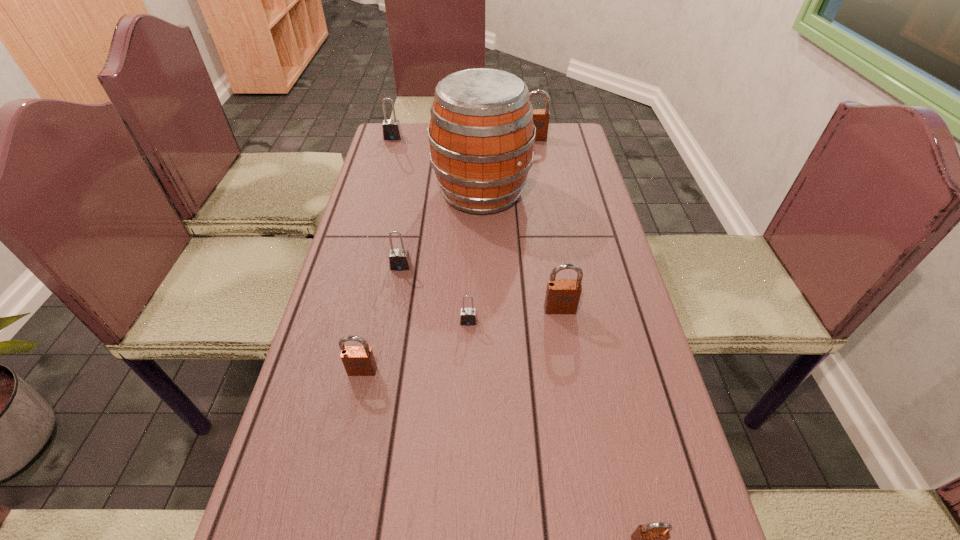
Where is `blank region between the second farthest brown padlock and the second biggest gray padlock`? This screenshot has height=540, width=960. blank region between the second farthest brown padlock and the second biggest gray padlock is located at coordinates (480, 288).

Locate an element on the screen. The height and width of the screenshot is (540, 960). vacant point located between the seventh shortest object and the sixth farthest padlock is located at coordinates (448, 255).

Find the location of a particular element. free space between the leftmost object and the third biggest brown padlock is located at coordinates (377, 254).

Identify the location of the seventh closest object to the farthest brown padlock. (652, 539).

Identify the location of the fourth closest object to the fifth farthest padlock. The image size is (960, 540). (481, 133).

Select which padlock is the fifth closest to the third farthest object. Please provide its 2D coordinates. Your answer should be formatted as a tuple, i.e. [(x, y)], where the tuple contains the x and y coordinates of a point satisfying the conditions above.

[(468, 317)]

Identify the location of padlock that is the fifth closest to the smallest gray padlock. This screenshot has width=960, height=540. (541, 117).

Find the location of a particular element. The image size is (960, 540). brown padlock that is the fourth closest to the leftmost gray padlock is located at coordinates click(652, 539).

Identify which brown padlock is the second nearest to the fifth farthest object. Please provide its 2D coordinates. Your answer should be formatted as a tuple, i.e. [(x, y)], where the tuple contains the x and y coordinates of a point satisfying the conditions above.

[(652, 539)]

The height and width of the screenshot is (540, 960). What are the coordinates of `gray padlock that stands as the closest to the third nearest brown padlock` in the screenshot? It's located at (468, 317).